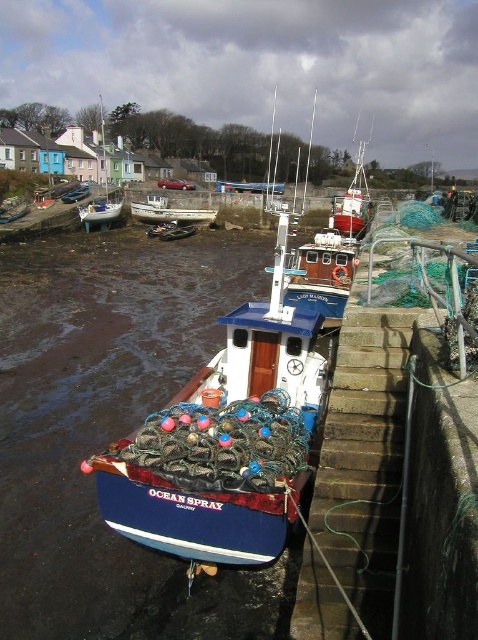
Can you confirm if blue matte fishing boat at center is positioned to the right of white wooden boat at center?

Yes, blue matte fishing boat at center is to the right of white wooden boat at center.

Between point (150, 486) and point (195, 220), which one is positioned in front?

Point (150, 486)

This screenshot has height=640, width=478. Find the location of `blue matte fishing boat at center`. blue matte fishing boat at center is located at coordinates 224,442.

Who is more forward, (229, 536) or (97, 209)?

Positioned in front is point (229, 536).

Is blue matte fishing boat at center bigger than white wooden boat at upper left?

Actually, blue matte fishing boat at center might be smaller than white wooden boat at upper left.

Where is `blue matte fishing boat at center`? The height and width of the screenshot is (640, 478). blue matte fishing boat at center is located at coordinates (224, 442).

Is white wooden boat at center in front of white wooden boat at upper left?

No, white wooden boat at center is further to the viewer.

Based on the photo, does white wooden boat at center have a lesser width compared to white wooden boat at upper left?

Correct, white wooden boat at center's width is less than white wooden boat at upper left's.

Locate an element on the screen. white wooden boat at center is located at coordinates 170,212.